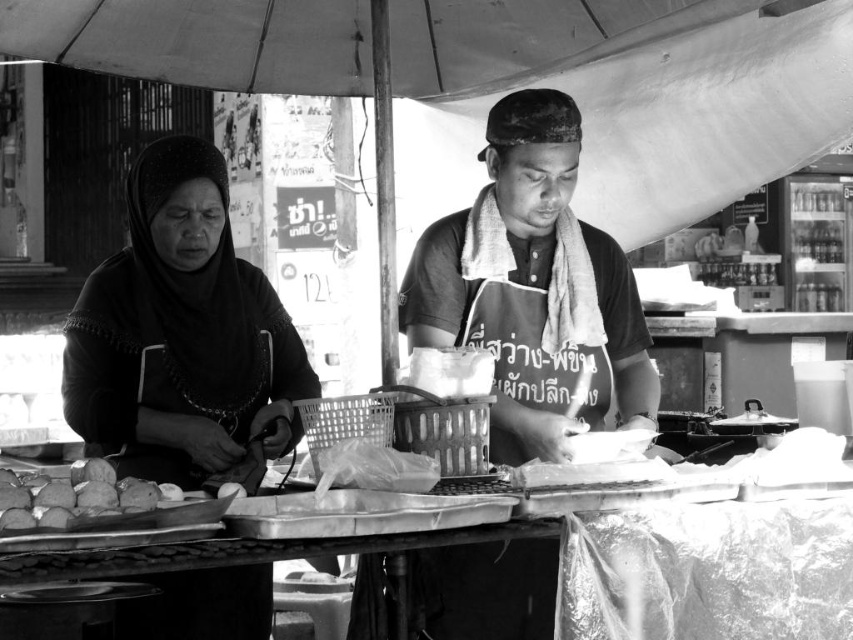
Question: Can you confirm if metallic tray at center is positioned to the right of smooth brown bread at lower left?

Choices:
 (A) no
 (B) yes

Answer: (B)

Question: Which point appears farthest from the camera in this image?

Choices:
 (A) (782, 586)
 (B) (103, 499)
 (C) (253, 362)

Answer: (C)

Question: Is smooth black fabric at left further to camera compared to metallic tray at center?

Choices:
 (A) no
 (B) yes

Answer: (B)

Question: Which object is the farthest from the smooth brown bread at lower left?

Choices:
 (A) metallic tray at center
 (B) smooth black fabric at left

Answer: (B)

Question: Does metallic tray at center have a greater width compared to smooth brown bread at lower left?

Choices:
 (A) yes
 (B) no

Answer: (A)

Question: Based on their relative distances, which object is farther from the smooth brown bread at lower left?

Choices:
 (A) metallic tray at center
 (B) smooth black fabric at left

Answer: (B)